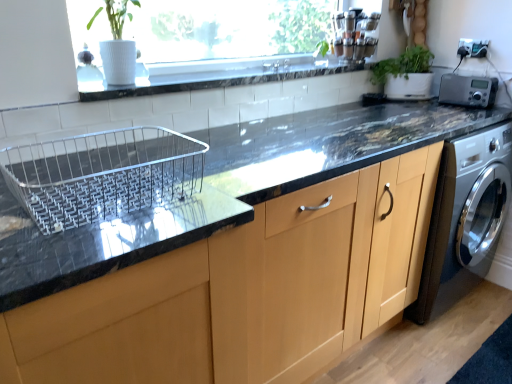
You are a GUI agent. You are given a task and a screenshot of the screen. Output one action in this format:
    pyautogui.click(x=<x>, y=<y>)
    Task: Click on the free spot above matte wood cabinet at center (from a real-world perspective)
    
    Given the screenshot: What is the action you would take?
    pyautogui.click(x=320, y=144)